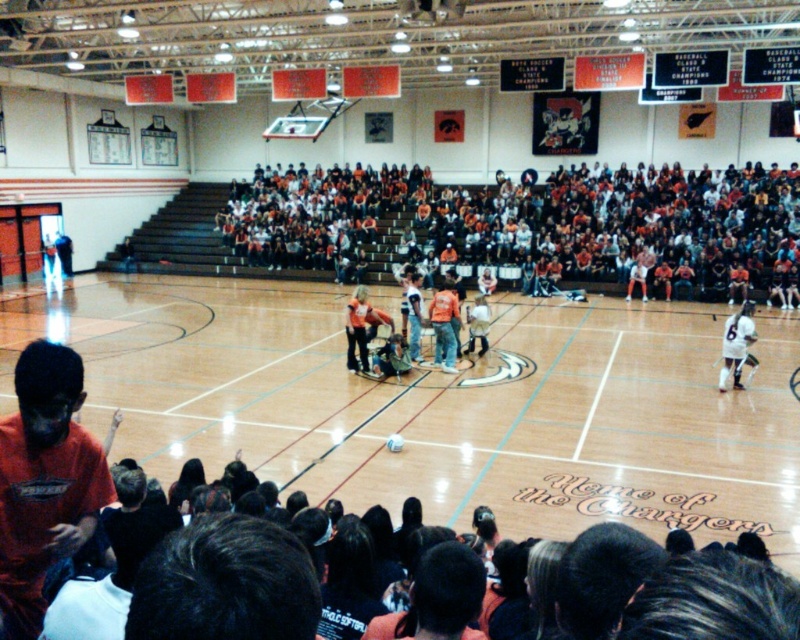
You are standing in the gymnasium and see the wooden floor at center and the white jersey at right. Which object is positioned to the left of the other?

The wooden floor at center is positioned to the left of the white jersey at right.

You are standing in the gymnasium and want to move towards the two points marked on the court. Which point, point (102, 333) or point (754, 310), will you reach first?

You will reach point (102, 333) first because it is closer to you than point (754, 310).